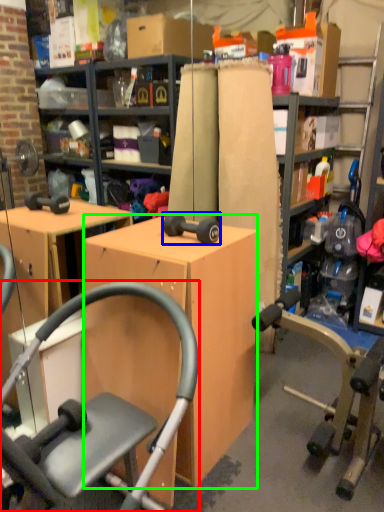
Question: Which object is positioned farthest from chair (highlighted by a red box)? Select from dumbbell (highlighted by a blue box) and desk (highlighted by a green box).

Choices:
 (A) dumbbell
 (B) desk

Answer: (A)